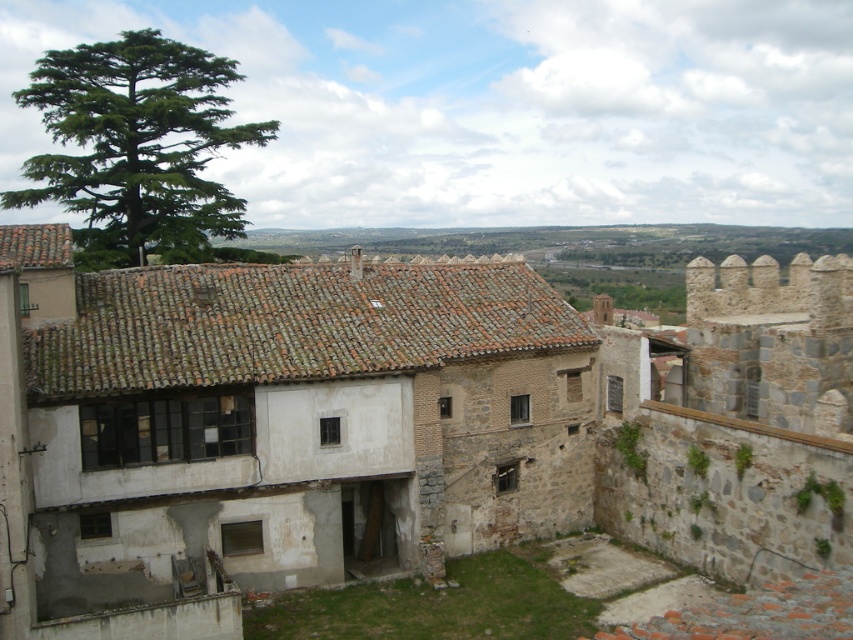
You are a tour guide standing at a safe distance from the rustic stone castle at center. Your group wants to take a photo of the castle from a spot that is exactly 20 meters away. Can you position them at the current location? Explain why or why not.

The rustic stone castle at center and the viewer are 20.52 meters apart. Since the desired distance is 20 meters, which is slightly closer than the current 20.52 meters, the group would need to move about 0.52 meters forward to achieve the exact 20 meter distance.